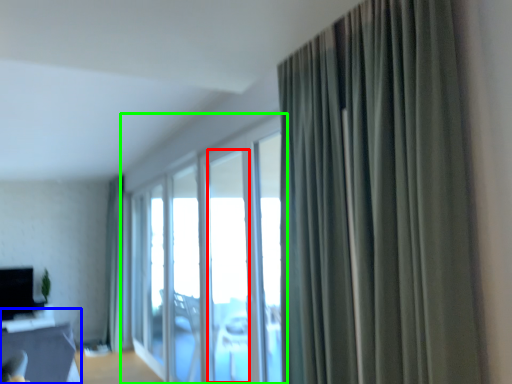
Question: Considering the real-world distances, which object is closest to window (highlighted by a red box)? table (highlighted by a blue box) or window (highlighted by a green box).

Choices:
 (A) table
 (B) window

Answer: (B)